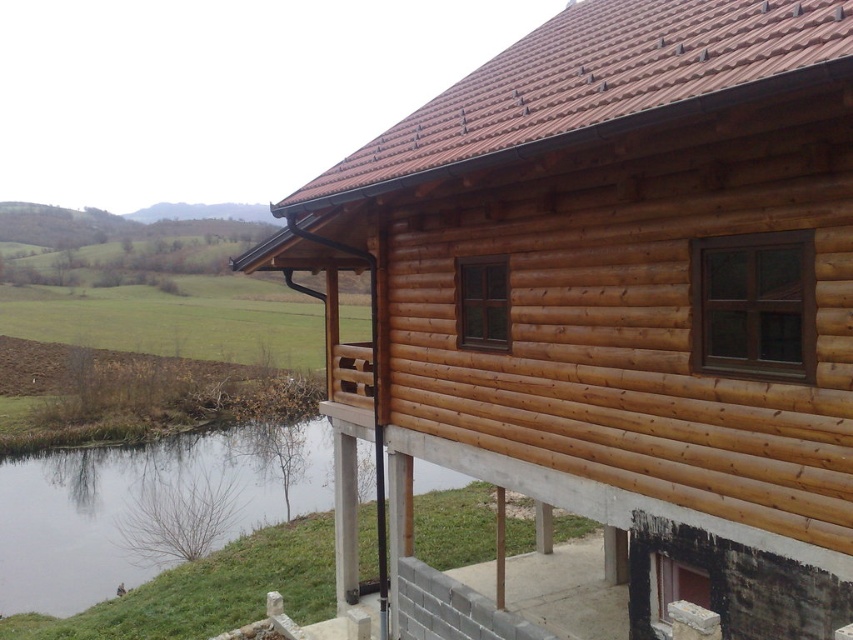
Question: Which point is closer to the camera?

Choices:
 (A) natural wood cabin at upper right
 (B) green grassy river at lower left

Answer: (A)

Question: Is natural wood cabin at upper right positioned before green grassy river at lower left?

Choices:
 (A) yes
 (B) no

Answer: (A)

Question: Is natural wood cabin at upper right above green grassy river at lower left?

Choices:
 (A) yes
 (B) no

Answer: (A)

Question: Observing the image, what is the correct spatial positioning of natural wood cabin at upper right in reference to green grassy river at lower left?

Choices:
 (A) right
 (B) left

Answer: (A)